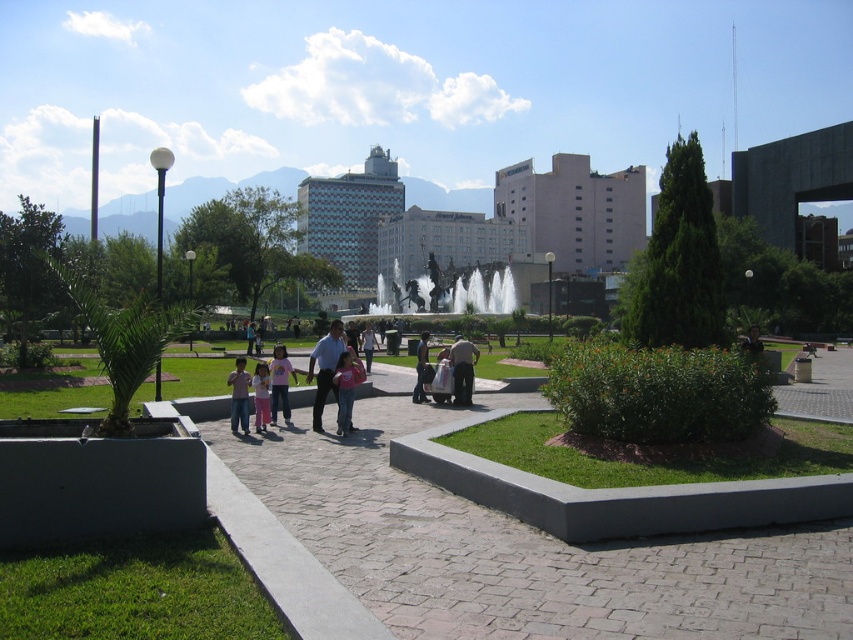
You are standing at the entrance of the park and want to locate the light blue shirt at center. According to the coordinates given, in which direction should you look to find it?

The light blue shirt at center is located at coordinates point 0.577 on the x axis and 0.382 on the y axis. Since the park entrance is at the origin point [0,0], you should look towards the northeast direction to find it.

Based on the photo, you are a photographer standing at the edge of the park fountain area. You want to capture a photo that includes both the light blue shirt at center and the pink fabric at center without any obstruction between them. Based on the scene description, can you estimate if there is enough space between the two objects to fit a 16 inch wide camera lens between them?

The light blue shirt at center is 17.57 inches from the pink fabric at center. Since the distance between them is greater than 16 inches, the camera lens can fit between them without obstruction.

You are a photographer setting up a tripod in the park. You need to position it so that it doesn not block the view of the fountain jets. You see the light brown leather jacket at center and the dark blue jeans at center. Which object takes up more horizontal space, meaning you might need to avoid placing the tripod near it?

The light brown leather jacket at center has a larger width than the dark blue jeans at center, so it takes up more horizontal space. You should avoid placing the tripod near the light brown leather jacket at center to prevent blocking the view of the fountain jets.